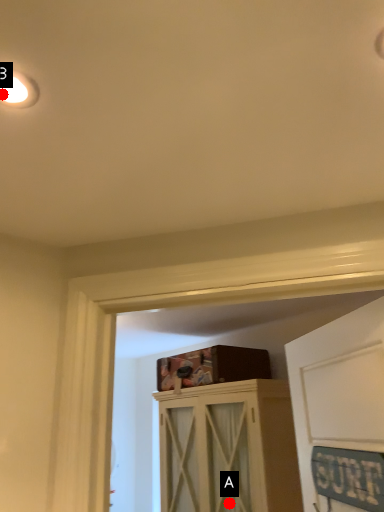
Question: Two points are circled on the image, labeled by A and B beside each circle. Which point is closer to the camera?

Choices:
 (A) A is closer
 (B) B is closer

Answer: (B)